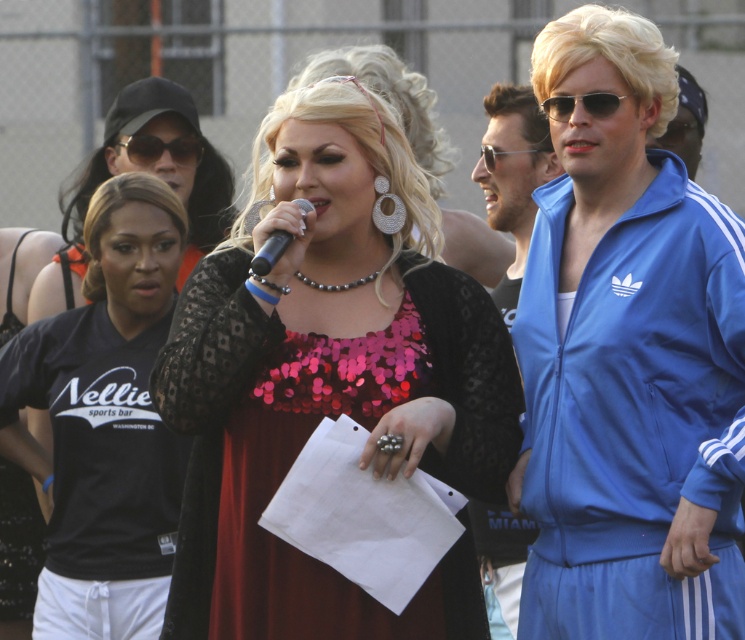
You are a photographer at the event and want to capture a photo of the black plastic microphone at center without the sunglasses at right appearing in the frame. Is it possible to do so given their sizes?

The sunglasses at right occupies less space than black plastic microphone at center, so it is possible to position the camera to exclude the sunglasses at right while focusing on the black plastic microphone at center.

You are a photographer at the event and want to capture a clear shot of both the black plastic sunglasses at upper left and the sunglasses at right. Which sunglasses should you focus on first to ensure they are in focus, considering their size in the frame?

The black plastic sunglasses at upper left is much taller than the sunglasses at right, so focusing on the black plastic sunglasses at upper left first would ensure proper focus due to its larger size in the frame.